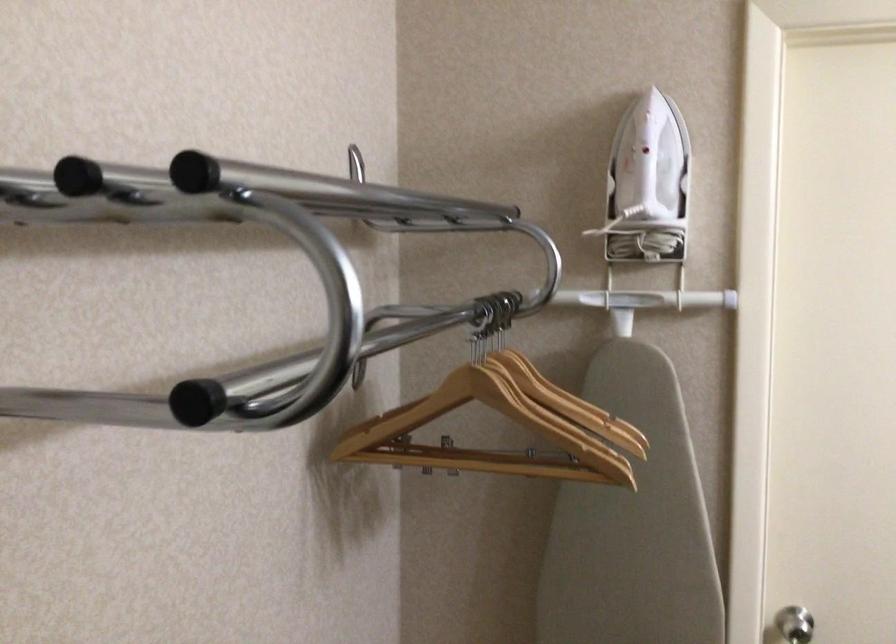
The height and width of the screenshot is (644, 896). What do you see at coordinates (337, 194) in the screenshot?
I see `the iron handle` at bounding box center [337, 194].